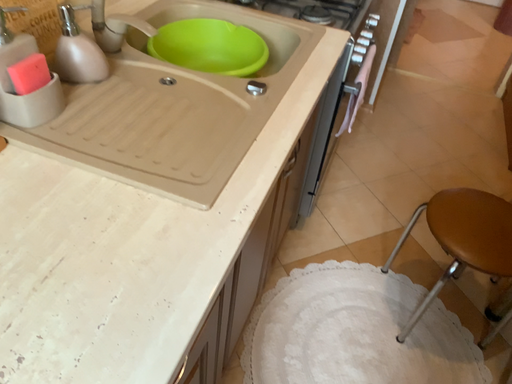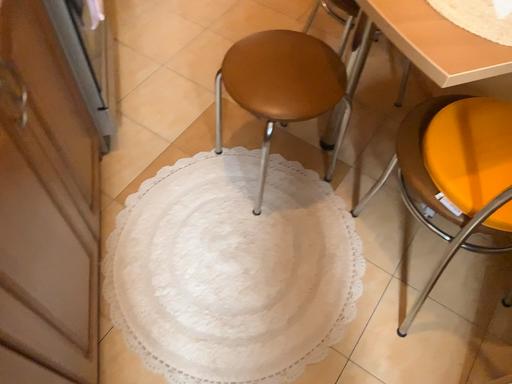
Question: How did the camera likely rotate when shooting the video?

Choices:
 (A) rotated right
 (B) rotated left

Answer: (A)